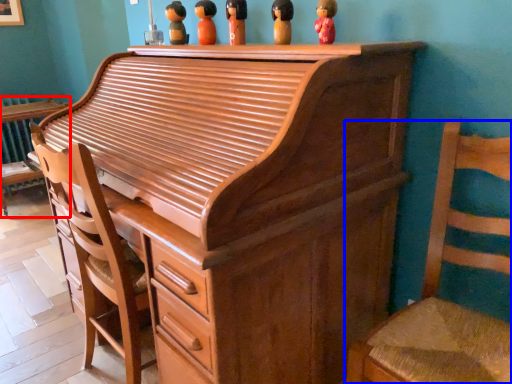
Question: Among these objects, which one is farthest to the camera, furniture (highlighted by a red box) or chair (highlighted by a blue box)?

Choices:
 (A) furniture
 (B) chair

Answer: (A)